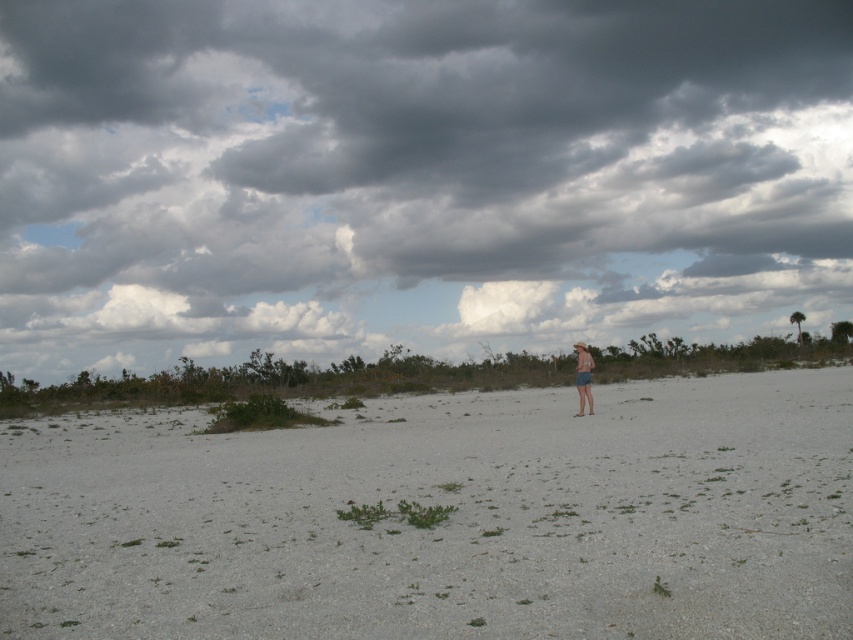
Question: Which object appears closest to the camera in this image?

Choices:
 (A) white sand at center
 (B) tan fabric shorts at center

Answer: (A)

Question: Does dark gray cloud at upper center have a lesser width compared to tan fabric shorts at center?

Choices:
 (A) yes
 (B) no

Answer: (B)

Question: Considering the relative positions of white sand at center and tan fabric shorts at center in the image provided, where is white sand at center located with respect to tan fabric shorts at center?

Choices:
 (A) below
 (B) above

Answer: (A)

Question: Estimate the real-world distances between objects in this image. Which object is closer to the dark gray cloud at upper center?

Choices:
 (A) white sand at center
 (B) tan fabric shorts at center

Answer: (A)

Question: Is the position of dark gray cloud at upper center more distant than that of tan fabric shorts at center?

Choices:
 (A) yes
 (B) no

Answer: (A)

Question: Among these objects, which one is nearest to the camera?

Choices:
 (A) dark gray cloud at upper center
 (B) tan fabric shorts at center
 (C) white sand at center

Answer: (C)